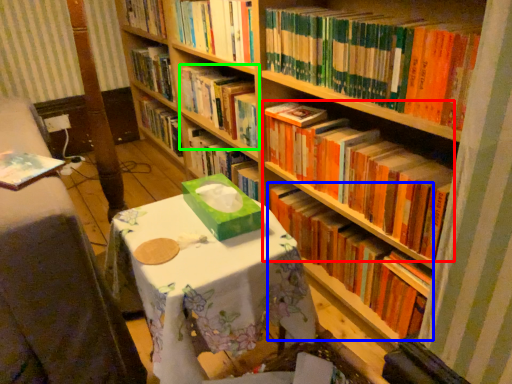
Question: Considering the real-world distances, which object is farthest from book (highlighted by a red box)? book (highlighted by a blue box) or book (highlighted by a green box)?

Choices:
 (A) book
 (B) book

Answer: (B)